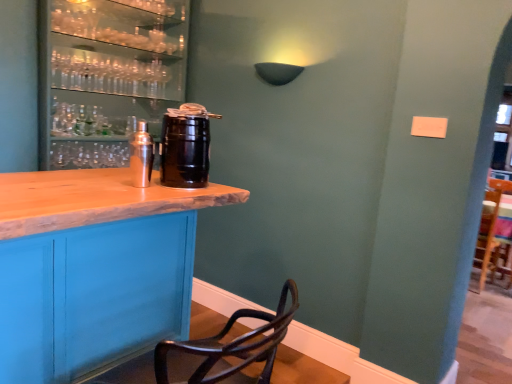
Find the location of a particular element. The width and height of the screenshot is (512, 384). matte black barrel at left is located at coordinates (106, 75).

Find the location of `black matte keg at center, the second beverage positioned from the left`. black matte keg at center, the second beverage positioned from the left is located at coordinates (184, 151).

Is black matte keg at center, the first beverage from the right, wider than shiny silver shaker at center, the first beverage in the left-to-right sequence?

Indeed, black matte keg at center, the first beverage from the right, has a greater width compared to shiny silver shaker at center, the first beverage in the left-to-right sequence.

What's the angular difference between black matte keg at center, the second beverage positioned from the left, and shiny silver shaker at center, the first beverage in the left-to-right sequence,'s facing directions?

The facing directions of black matte keg at center, the second beverage positioned from the left, and shiny silver shaker at center, the first beverage in the left-to-right sequence, are 0.00634 degrees apart.

From a real-world perspective, is black matte keg at center, the second beverage positioned from the left, below shiny silver shaker at center, the first beverage in the left-to-right sequence?

No.

Based on the photo, is black matte keg at center, the first beverage from the right, not close to shiny silver shaker at center, which is counted as the second beverage, starting from the right?

They are positioned close to each other.

From the image's perspective, is matte black barrel at left under shiny silver shaker at center, the first beverage in the left-to-right sequence?

Incorrect, from the image's perspective, matte black barrel at left is higher than shiny silver shaker at center, the first beverage in the left-to-right sequence.

Would you consider matte black barrel at left to be distant from shiny silver shaker at center, which is counted as the second beverage, starting from the right?

No, matte black barrel at left is in close proximity to shiny silver shaker at center, which is counted as the second beverage, starting from the right.

Measure the distance between matte black barrel at left and shiny silver shaker at center, the first beverage in the left-to-right sequence.

matte black barrel at left is 21.44 inches away from shiny silver shaker at center, the first beverage in the left-to-right sequence.

Considering the positions of points (70, 8) and (139, 166), is point (70, 8) closer to camera compared to point (139, 166)?

No, it is behind (139, 166).

Considering the relative sizes of shiny silver shaker at center, which is counted as the second beverage, starting from the right, and matte black barrel at left in the image provided, is shiny silver shaker at center, which is counted as the second beverage, starting from the right, smaller than matte black barrel at left?

Yes, shiny silver shaker at center, which is counted as the second beverage, starting from the right, is smaller than matte black barrel at left.

Between shiny silver shaker at center, which is counted as the second beverage, starting from the right, and matte black barrel at left, which one has larger width?

matte black barrel at left.

From the image's perspective, is shiny silver shaker at center, which is counted as the second beverage, starting from the right, above or below matte black barrel at left?

Based on their image positions, shiny silver shaker at center, which is counted as the second beverage, starting from the right, is located beneath matte black barrel at left.

From the matte black barrel at left, count 2nd beverage to the right and point to it. Please provide its 2D coordinates.

[(184, 151)]

In the scene shown: Which object is thinner, matte black barrel at left or black matte keg at center, the second beverage positioned from the left?

Thinner between the two is black matte keg at center, the second beverage positioned from the left.

Considering the sizes of matte black barrel at left and black matte keg at center, the first beverage from the right, in the image, is matte black barrel at left taller or shorter than black matte keg at center, the first beverage from the right,?

Considering their sizes, matte black barrel at left has more height than black matte keg at center, the first beverage from the right.

Identify the location of shelf above the black matte keg at center, the second beverage positioned from the left (from the image's perspective). (106, 75).

From a real-world perspective, which object rests below the other?

black matte keg at center, the first beverage from the right, is physically lower.

Can you see black matte keg at center, the second beverage positioned from the left, touching matte black barrel at left?

black matte keg at center, the second beverage positioned from the left, and matte black barrel at left are not in contact.

Is shiny silver shaker at center, the first beverage in the left-to-right sequence, inside the boundaries of black matte keg at center, the second beverage positioned from the left, or outside?

shiny silver shaker at center, the first beverage in the left-to-right sequence, is spatially situated outside black matte keg at center, the second beverage positioned from the left.

Consider the image. From the image's perspective, who appears lower, shiny silver shaker at center, the first beverage in the left-to-right sequence, or black matte keg at center, the first beverage from the right?

shiny silver shaker at center, the first beverage in the left-to-right sequence, from the image's perspective.

Does shiny silver shaker at center, the first beverage in the left-to-right sequence, appear on the right side of black matte keg at center, the first beverage from the right?

No.

Identify the location of beverage in front of the shiny silver shaker at center, the first beverage in the left-to-right sequence. This screenshot has width=512, height=384. (184, 151).

At what (x,y) coordinates should I click in order to perform the action: click on shelf on the left of shiny silver shaker at center, the first beverage in the left-to-right sequence. Please return your answer as a coordinate pair (x, y). Looking at the image, I should click on (106, 75).

Looking at the image, which one is located closer to shiny silver shaker at center, the first beverage in the left-to-right sequence, black matte keg at center, the first beverage from the right, or matte black barrel at left?

Based on the image, black matte keg at center, the first beverage from the right, appears to be nearer to shiny silver shaker at center, the first beverage in the left-to-right sequence.

Considering their positions, is matte black barrel at left positioned closer to shiny silver shaker at center, the first beverage in the left-to-right sequence, than black matte keg at center, the first beverage from the right?

Based on the image, black matte keg at center, the first beverage from the right, appears to be nearer to shiny silver shaker at center, the first beverage in the left-to-right sequence.

Consider the image. When comparing their distances from black matte keg at center, the first beverage from the right, does matte black barrel at left or shiny silver shaker at center, the first beverage in the left-to-right sequence, seem further?

Among the two, matte black barrel at left is located further to black matte keg at center, the first beverage from the right.

Considering their positions, is black matte keg at center, the first beverage from the right, positioned further to matte black barrel at left than shiny silver shaker at center, which is counted as the second beverage, starting from the right?

Among the two, black matte keg at center, the first beverage from the right, is located further to matte black barrel at left.

Considering their positions, is shiny silver shaker at center, which is counted as the second beverage, starting from the right, positioned closer to matte black barrel at left than black matte keg at center, the first beverage from the right?

shiny silver shaker at center, which is counted as the second beverage, starting from the right, is closer to matte black barrel at left.

Based on their spatial positions, is shiny silver shaker at center, which is counted as the second beverage, starting from the right, or matte black barrel at left further from black matte keg at center, the first beverage from the right?

matte black barrel at left lies further to black matte keg at center, the first beverage from the right, than the other object.

At what (x,y) coordinates should I click in order to perform the action: click on beverage positioned between black matte keg at center, the first beverage from the right, and matte black barrel at left from near to far. Please return your answer as a coordinate pair (x, y). Looking at the image, I should click on (141, 156).